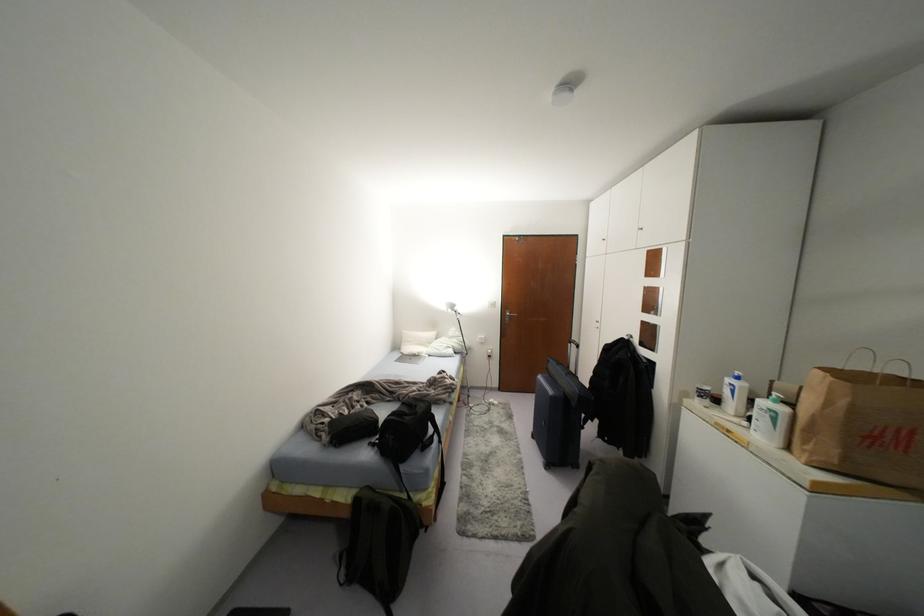
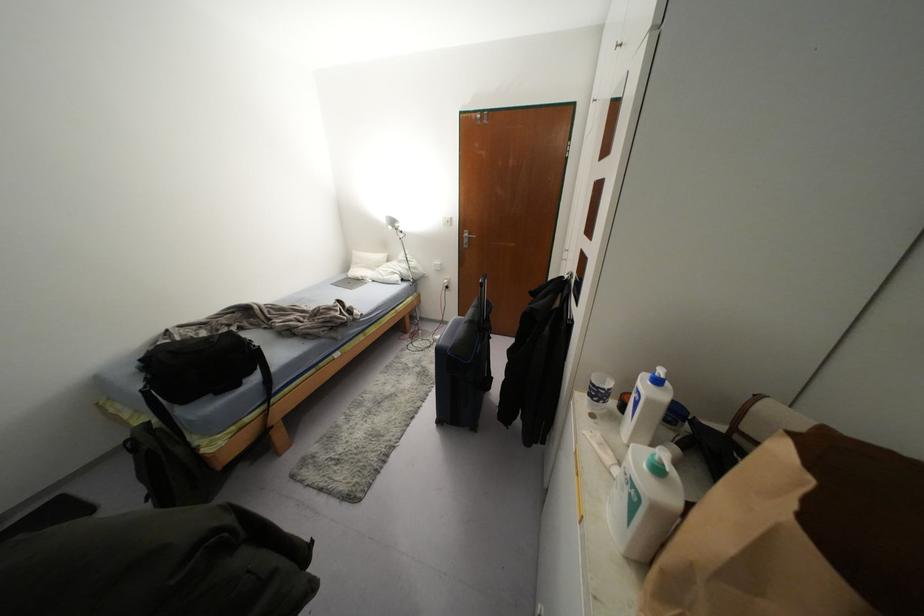
Where in the second image is the point corresponding to point 773,419 from the first image?

(633, 505)